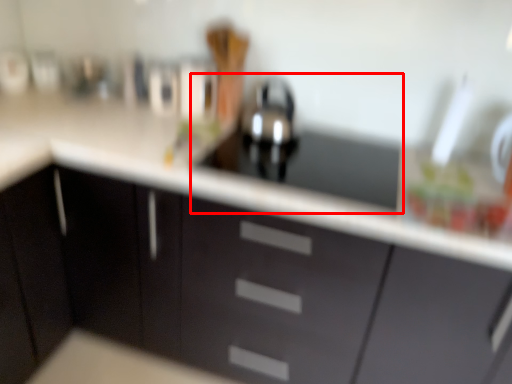
Question: From the image's perspective, where is sink (annotated by the red box) located relative to cabinetry?

Choices:
 (A) below
 (B) above

Answer: (B)